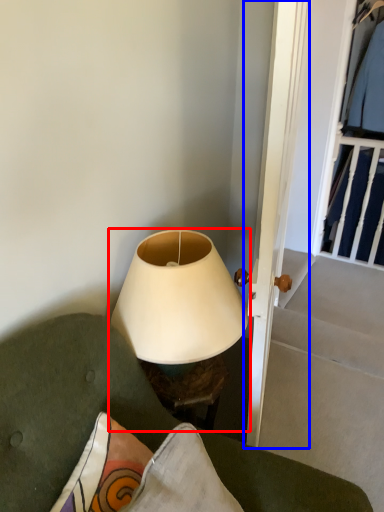
Question: Which object is further to the camera taking this photo, lamp (highlighted by a red box) or door (highlighted by a blue box)?

Choices:
 (A) lamp
 (B) door

Answer: (A)